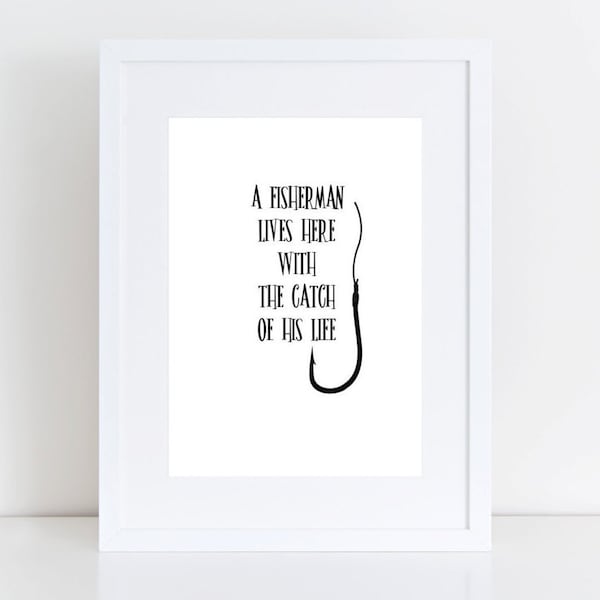
Locate an element on the screen. Image resolution: width=600 pixels, height=600 pixels. wall is located at coordinates (534, 350).